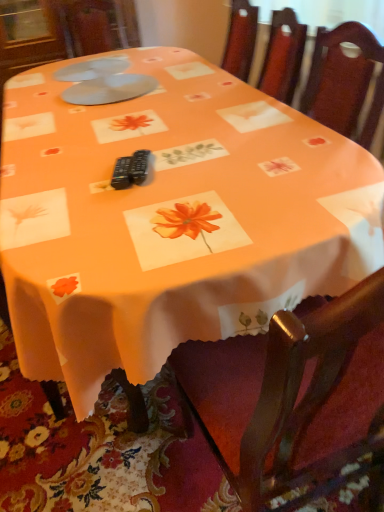
Image resolution: width=384 pixels, height=512 pixels. Find the location of `white plastic plates at upper center, the first tableware positioned from the back`. white plastic plates at upper center, the first tableware positioned from the back is located at coordinates [x=92, y=69].

Measure the distance between white plastic plates at upper center, the 2th tableware from the front, and camera.

1.86 meters.

In order to face white plastic plates at upper center, the 2th tableware from the front, should I rotate leftwards or rightwards?

It's best to rotate left around 13.012 degrees.

What do you see at coordinates (92, 69) in the screenshot? The width and height of the screenshot is (384, 512). I see `white plastic plates at upper center, the first tableware positioned from the back` at bounding box center [92, 69].

What is the approximate width of white plastic plates at upper center, the 2th tableware from the front?

15.38 inches.

What is the approximate height of white plastic plates at upper center, the first tableware positioned from the back?

white plastic plates at upper center, the first tableware positioned from the back, is 0.91 inches tall.

This screenshot has width=384, height=512. In order to click on matte plastic plates at upper center, marked as the 2th tableware in a back-to-front arrangement in this screenshot , I will do `click(109, 89)`.

Describe the element at coordinates (109, 89) in the screenshot. Image resolution: width=384 pixels, height=512 pixels. I see `matte plastic plates at upper center, the first tableware positioned from the front` at that location.

In order to face matte plastic plates at upper center, the first tableware positioned from the front, should I rotate leftwards or rightwards?

Turn left approximately 11.023 degrees to face it.

Image resolution: width=384 pixels, height=512 pixels. I want to click on white plastic plates at upper center, the first tableware positioned from the back, so click(x=92, y=69).

Between white plastic plates at upper center, the 2th tableware from the front, and matte plastic plates at upper center, marked as the 2th tableware in a back-to-front arrangement, which one appears on the right side from the viewer's perspective?

From the viewer's perspective, matte plastic plates at upper center, marked as the 2th tableware in a back-to-front arrangement, appears more on the right side.

Is the position of white plastic plates at upper center, the first tableware positioned from the back, less distant than that of matte plastic plates at upper center, the first tableware positioned from the front?

No, it is not.

Considering the positions of point (60, 70) and point (124, 97), is point (60, 70) closer or farther from the camera than point (124, 97)?

Point (60, 70) is farther from the camera than point (124, 97).

From the image's perspective, is white plastic plates at upper center, the 2th tableware from the front, below matte plastic plates at upper center, marked as the 2th tableware in a back-to-front arrangement?

Incorrect, from the image's perspective, white plastic plates at upper center, the 2th tableware from the front, is higher than matte plastic plates at upper center, marked as the 2th tableware in a back-to-front arrangement.

From a real-world perspective, which is physically below, white plastic plates at upper center, the first tableware positioned from the back, or matte plastic plates at upper center, the first tableware positioned from the front?

From a 3D spatial view, matte plastic plates at upper center, the first tableware positioned from the front, is below.

Considering the sizes of objects white plastic plates at upper center, the 2th tableware from the front, and matte plastic plates at upper center, marked as the 2th tableware in a back-to-front arrangement, in the image provided, who is wider, white plastic plates at upper center, the 2th tableware from the front, or matte plastic plates at upper center, marked as the 2th tableware in a back-to-front arrangement,?

matte plastic plates at upper center, marked as the 2th tableware in a back-to-front arrangement, is wider.

Does white plastic plates at upper center, the first tableware positioned from the back, have a lesser height compared to matte plastic plates at upper center, the first tableware positioned from the front?

Yes.

Is white plastic plates at upper center, the first tableware positioned from the back, bigger or smaller than matte plastic plates at upper center, marked as the 2th tableware in a back-to-front arrangement?

In the image, white plastic plates at upper center, the first tableware positioned from the back, appears to be smaller than matte plastic plates at upper center, marked as the 2th tableware in a back-to-front arrangement.

Can we say white plastic plates at upper center, the first tableware positioned from the back, lies outside matte plastic plates at upper center, the first tableware positioned from the front?

Yes.

Can you see white plastic plates at upper center, the 2th tableware from the front, touching matte plastic plates at upper center, marked as the 2th tableware in a back-to-front arrangement?

white plastic plates at upper center, the 2th tableware from the front, is not next to matte plastic plates at upper center, marked as the 2th tableware in a back-to-front arrangement, and they're not touching.

Is white plastic plates at upper center, the first tableware positioned from the back, looking in the opposite direction of matte plastic plates at upper center, the first tableware positioned from the front?

white plastic plates at upper center, the first tableware positioned from the back, is not turned away from matte plastic plates at upper center, the first tableware positioned from the front.

How different are the orientations of white plastic plates at upper center, the first tableware positioned from the back, and matte plastic plates at upper center, the first tableware positioned from the front, in degrees?

There is a 0.000266-degree angle between the facing directions of white plastic plates at upper center, the first tableware positioned from the back, and matte plastic plates at upper center, the first tableware positioned from the front.

I want to click on tableware lying below the white plastic plates at upper center, the 2th tableware from the front (from the image's perspective), so click(x=109, y=89).

Between matte plastic plates at upper center, the first tableware positioned from the front, and white plastic plates at upper center, the first tableware positioned from the back, which one appears on the left side from the viewer's perspective?

white plastic plates at upper center, the first tableware positioned from the back.

Is matte plastic plates at upper center, the first tableware positioned from the front, positioned behind white plastic plates at upper center, the 2th tableware from the front?

No, it is in front of white plastic plates at upper center, the 2th tableware from the front.

Is point (93, 87) less distant than point (121, 63)?

Yes.

From the image's perspective, which is below, matte plastic plates at upper center, the first tableware positioned from the front, or white plastic plates at upper center, the first tableware positioned from the back?

matte plastic plates at upper center, the first tableware positioned from the front, from the image's perspective.

From a real-world perspective, is matte plastic plates at upper center, marked as the 2th tableware in a back-to-front arrangement, positioned over white plastic plates at upper center, the first tableware positioned from the back, based on gravity?

No, from a real-world perspective, matte plastic plates at upper center, marked as the 2th tableware in a back-to-front arrangement, is not on top of white plastic plates at upper center, the first tableware positioned from the back.

Which of these two, matte plastic plates at upper center, the first tableware positioned from the front, or white plastic plates at upper center, the first tableware positioned from the back, is thinner?

white plastic plates at upper center, the first tableware positioned from the back.

Who is shorter, matte plastic plates at upper center, marked as the 2th tableware in a back-to-front arrangement, or white plastic plates at upper center, the 2th tableware from the front?

→ white plastic plates at upper center, the 2th tableware from the front.

Considering the sizes of objects matte plastic plates at upper center, the first tableware positioned from the front, and white plastic plates at upper center, the first tableware positioned from the back, in the image provided, who is smaller, matte plastic plates at upper center, the first tableware positioned from the front, or white plastic plates at upper center, the first tableware positioned from the back,?

white plastic plates at upper center, the first tableware positioned from the back, is smaller.

Can we say matte plastic plates at upper center, marked as the 2th tableware in a back-to-front arrangement, lies outside white plastic plates at upper center, the first tableware positioned from the back?

Yes, matte plastic plates at upper center, marked as the 2th tableware in a back-to-front arrangement, is located beyond the bounds of white plastic plates at upper center, the first tableware positioned from the back.

Are matte plastic plates at upper center, the first tableware positioned from the front, and white plastic plates at upper center, the first tableware positioned from the back, beside each other?

matte plastic plates at upper center, the first tableware positioned from the front, is not next to white plastic plates at upper center, the first tableware positioned from the back, and they're not touching.

Consider the image. Is matte plastic plates at upper center, the first tableware positioned from the front, turned away from white plastic plates at upper center, the first tableware positioned from the back?

No, matte plastic plates at upper center, the first tableware positioned from the front,'s orientation is not away from white plastic plates at upper center, the first tableware positioned from the back.

Can you tell me how much matte plastic plates at upper center, marked as the 2th tableware in a back-to-front arrangement, and white plastic plates at upper center, the first tableware positioned from the back, differ in facing direction?

The angle between the facing direction of matte plastic plates at upper center, marked as the 2th tableware in a back-to-front arrangement, and the facing direction of white plastic plates at upper center, the first tableware positioned from the back, is 0.000266 degrees.

The width and height of the screenshot is (384, 512). I want to click on tableware below the white plastic plates at upper center, the first tableware positioned from the back (from the image's perspective), so click(x=109, y=89).

The image size is (384, 512). What are the coordinates of `tableware below the white plastic plates at upper center, the 2th tableware from the front (from the image's perspective)` in the screenshot? It's located at point(109,89).

The height and width of the screenshot is (512, 384). I want to click on tableware on the right of white plastic plates at upper center, the first tableware positioned from the back, so click(109, 89).